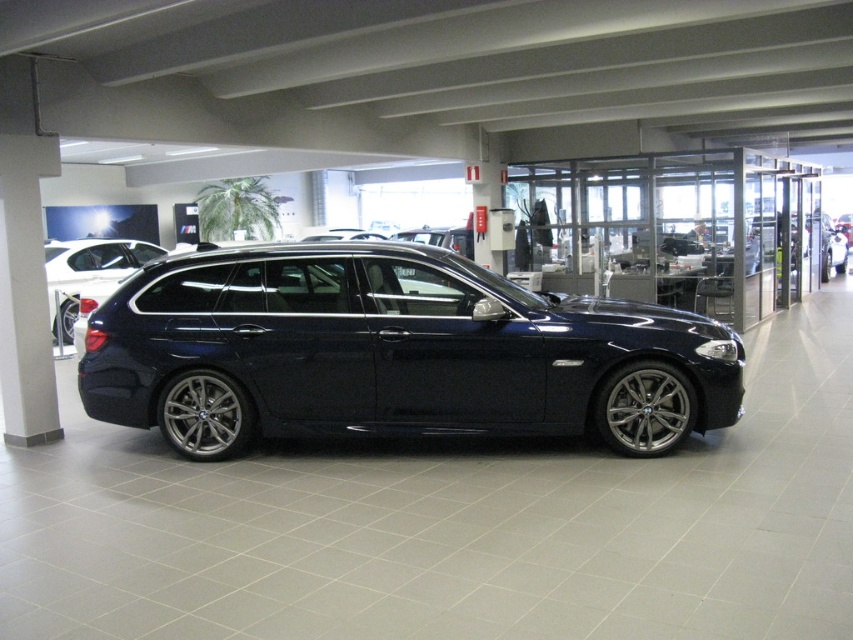
Question: Does satin black sedan at center appear on the right side of glossy dark blue sedan at center?

Choices:
 (A) yes
 (B) no

Answer: (B)

Question: Which object is closer to the camera taking this photo?

Choices:
 (A) glossy dark blue sedan at center
 (B) satin black sedan at center
 (C) white glossy pillar at left

Answer: (B)

Question: Among these objects, which one is farthest from the camera?

Choices:
 (A) satin black sedan at center
 (B) glossy dark blue sedan at center

Answer: (B)

Question: Can you confirm if white glossy pillar at left is wider than satin black car at center?

Choices:
 (A) no
 (B) yes

Answer: (A)

Question: Among these objects, which one is farthest from the camera?

Choices:
 (A) glossy dark blue sedan at center
 (B) satin black sedan at center

Answer: (A)

Question: Where is white glossy pillar at left located in relation to glossy dark blue sedan at center in the image?

Choices:
 (A) below
 (B) above

Answer: (A)